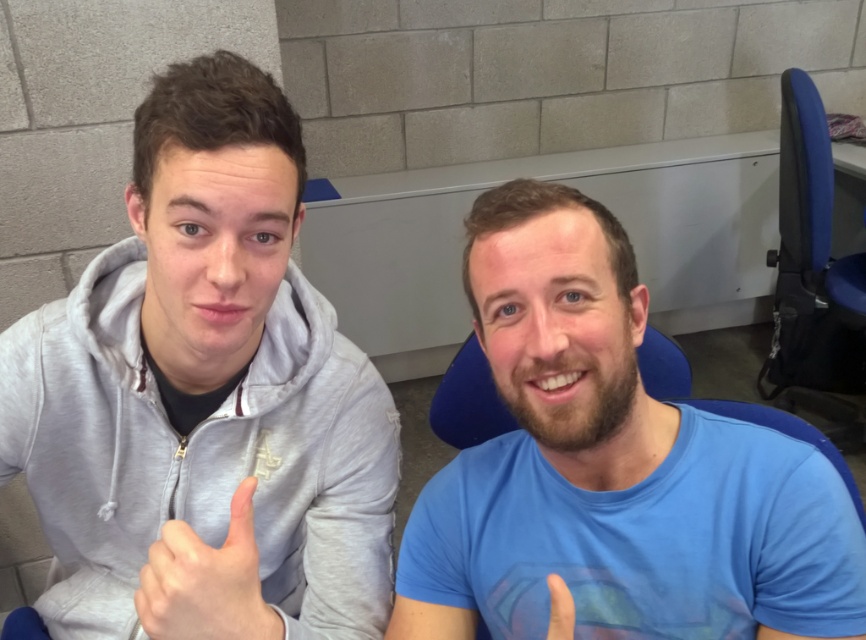
You are a photographer trying to capture a closeup of the blue matte shirt at center and the matte blue finger at center. Which object should you focus on to ensure the other remains in the background?

You should focus on the blue matte shirt at center because it is closer to the viewer than the matte blue finger at center, so focusing on it will keep the matte blue finger at center in the background.